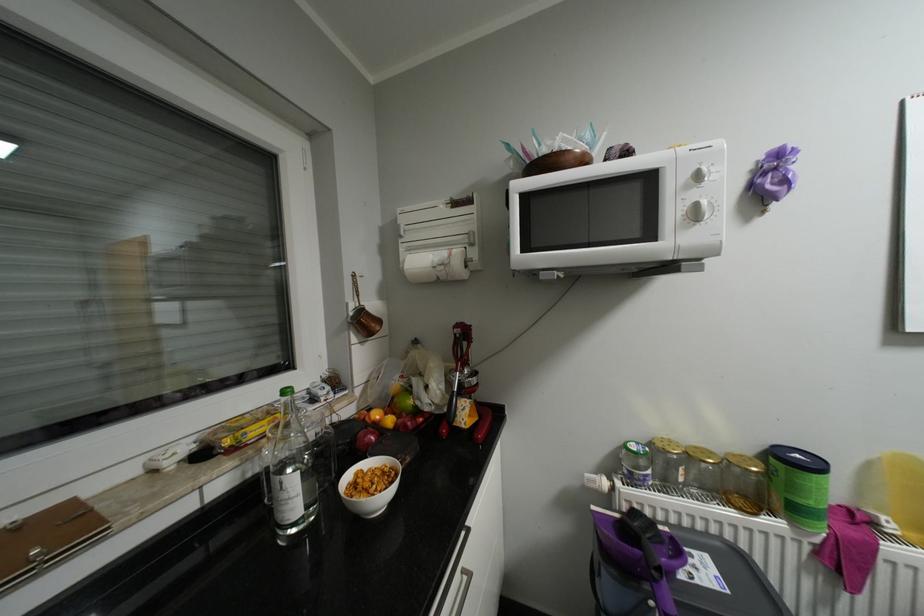
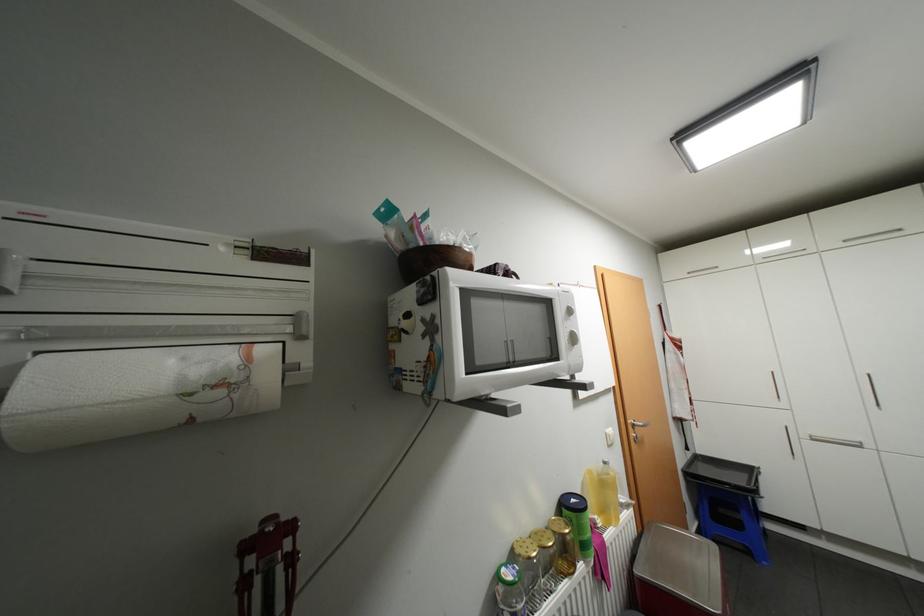
Find the pixel in the second image that matches point (641, 447) in the first image.

(518, 576)